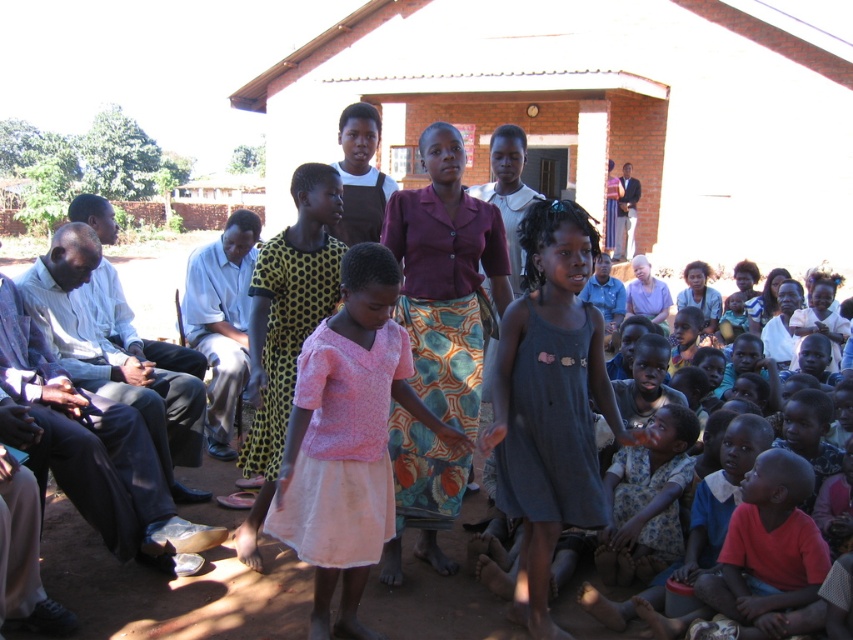
Question: Which point is farther to the camera?

Choices:
 (A) (318, 561)
 (B) (421, 436)

Answer: (B)

Question: Is dark gray cotton dress at center bigger than light brown fabric shirt at left?

Choices:
 (A) no
 (B) yes

Answer: (A)

Question: Which of these objects is positioned farthest from the pink fabric dress at center?

Choices:
 (A) white shirt at left
 (B) light blue shirt at left
 (C) dark gray cotton dress at center
 (D) light brown fabric shirt at left

Answer: (D)

Question: Observing the image, what is the correct spatial positioning of purple fabric skirt at center in reference to light blue shirt at left?

Choices:
 (A) left
 (B) right

Answer: (B)

Question: Is the position of white shirt at left more distant than that of light brown fabric shirt at left?

Choices:
 (A) no
 (B) yes

Answer: (B)

Question: Which of the following is the farthest from the observer?

Choices:
 (A) (328, 438)
 (B) (236, 346)
 (C) (463, 260)
 (D) (167, 416)

Answer: (B)